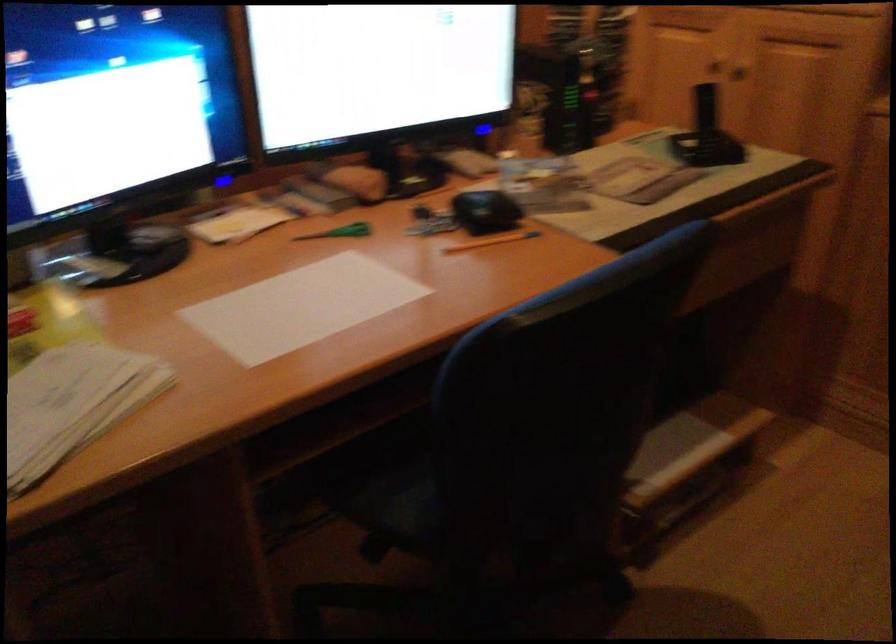
Question: The camera is either moving clockwise (left) or counter-clockwise (right) around the object. The first image is from the beginning of the video and the second image is from the end. Is the camera moving left or right when shooting the video?

Choices:
 (A) Left
 (B) Right

Answer: (A)